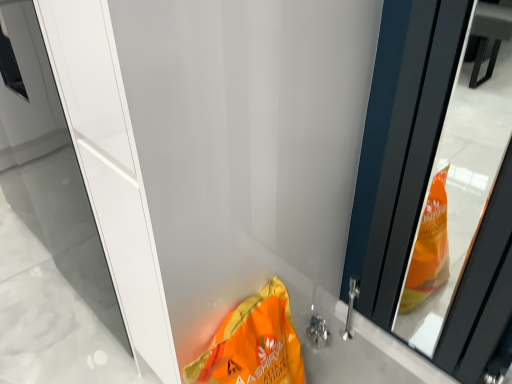
Question: Based on their positions, is white glossy screen door at center located to the left or right of orange matte bag at lower center?

Choices:
 (A) left
 (B) right

Answer: (A)

Question: Does point (117, 301) appear closer or farther from the camera than point (208, 367)?

Choices:
 (A) closer
 (B) farther

Answer: (B)

Question: Is white glossy screen door at center wider or thinner than orange matte bag at lower center?

Choices:
 (A) thin
 (B) wide

Answer: (B)

Question: From their relative heights in the image, would you say orange matte bag at lower center is taller or shorter than white glossy screen door at center?

Choices:
 (A) tall
 (B) short

Answer: (B)

Question: Considering the positions of orange matte bag at lower center and white glossy screen door at center in the image, is orange matte bag at lower center wider or thinner than white glossy screen door at center?

Choices:
 (A) thin
 (B) wide

Answer: (A)

Question: From the image's perspective, is orange matte bag at lower center above or below white glossy screen door at center?

Choices:
 (A) above
 (B) below

Answer: (B)

Question: Is point (262, 322) positioned closer to the camera than point (109, 107)?

Choices:
 (A) closer
 (B) farther

Answer: (B)